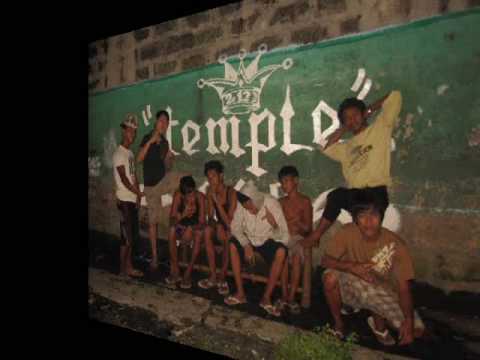
The width and height of the screenshot is (480, 360). I want to click on green wall, so click(x=194, y=98).